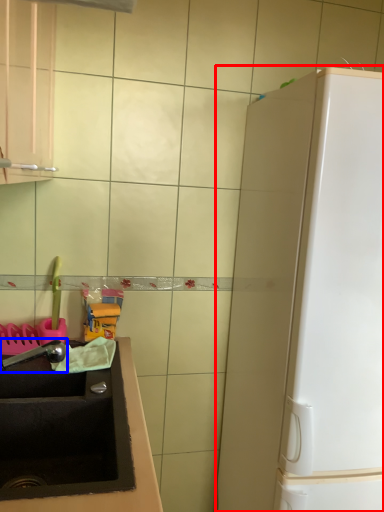
Question: Which of the following is the closest to the observer, appliance (highlighted by a red box) or faucet (highlighted by a blue box)?

Choices:
 (A) appliance
 (B) faucet

Answer: (A)